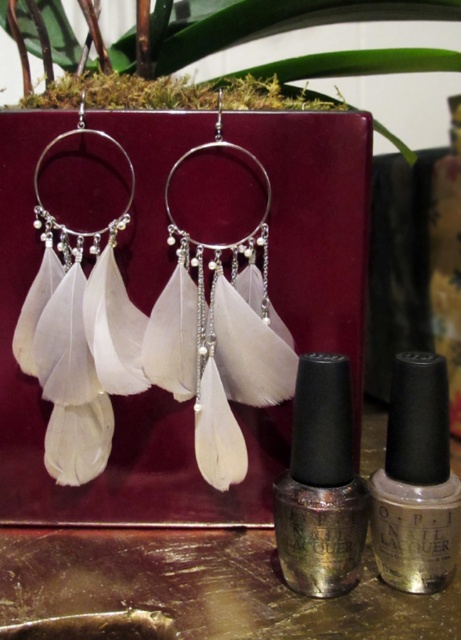
Question: Is metallic silver nail polish at center behind metallic gold nail lacquer at center?

Choices:
 (A) yes
 (B) no

Answer: (B)

Question: Is metallic silver nail polish at center further to the viewer compared to metallic gold nail lacquer at center?

Choices:
 (A) no
 (B) yes

Answer: (A)

Question: Where is metallic silver nail polish at center located in relation to metallic gold nail lacquer at center in the image?

Choices:
 (A) left
 (B) right

Answer: (A)

Question: Which object is closer to the camera taking this photo?

Choices:
 (A) metallic gold nail lacquer at center
 (B) metallic silver nail polish at center

Answer: (B)